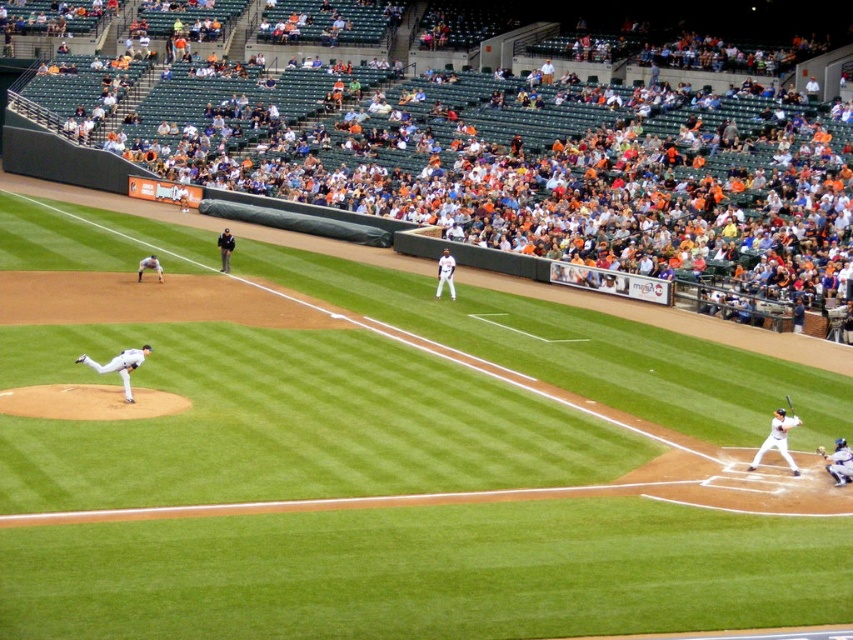
The width and height of the screenshot is (853, 640). I want to click on orange fabric seats at upper center, so click(520, 168).

Who is more forward, (252, 109) or (822, 451)?

Positioned in front is point (822, 451).

You are a GUI agent. You are given a task and a screenshot of the screen. Output one action in this format:
    pyautogui.click(x=<x>, y=<y>)
    Task: Click on the orange fabric seats at upper center
    The width and height of the screenshot is (853, 640).
    Given the screenshot: What is the action you would take?
    point(520,168)

Between orange fabric seats at upper center and white matte bat at lower right, which one appears on the left side from the viewer's perspective?

Positioned to the left is orange fabric seats at upper center.

Who is lower down, orange fabric seats at upper center or white matte bat at lower right?

Positioned lower is white matte bat at lower right.

Who is more distant from viewer, (778, 268) or (756, 467)?

Positioned behind is point (778, 268).

Locate an element on the screen. The image size is (853, 640). orange fabric seats at upper center is located at coordinates (520, 168).

Can you confirm if white uniform at center is thinner than yellow fabric baseball glove at center?

In fact, white uniform at center might be wider than yellow fabric baseball glove at center.

Between white uniform at center and yellow fabric baseball glove at center, which one is positioned higher?

Positioned higher is white uniform at center.

Describe the element at coordinates (119, 365) in the screenshot. I see `white uniform at center` at that location.

Where is `white uniform at center`? white uniform at center is located at coordinates (119, 365).